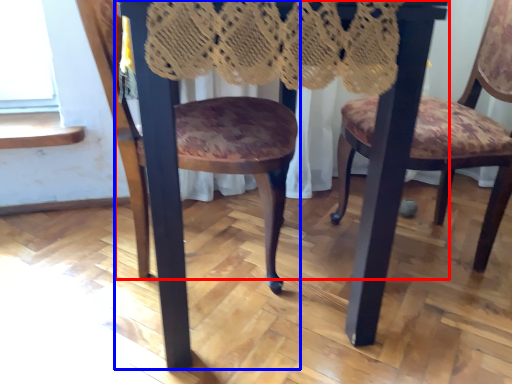
Question: Among these objects, which one is nearest to the camera, table (highlighted by a red box) or chair (highlighted by a blue box)?

Choices:
 (A) table
 (B) chair

Answer: (A)